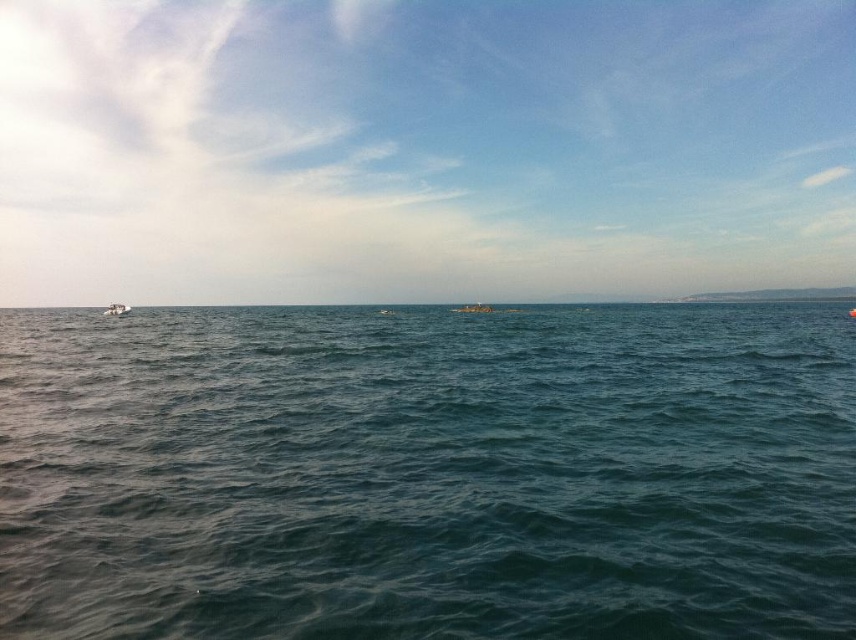
Who is positioned more to the right, blue water at center or metallic silver boat at center?

metallic silver boat at center

Is blue water at center shorter than metallic silver boat at center?

No.

Which is in front, point (409, 17) or point (468, 305)?

Point (468, 305) is more forward.

At what (x,y) coordinates should I click in order to perform the action: click on blue water at center. Please return your answer as a coordinate pair (x, y). Image resolution: width=856 pixels, height=640 pixels. Looking at the image, I should click on (421, 147).

Find the location of a particular element. blue water at center is located at coordinates (421, 147).

Is blue water at center above white plastic boat at left?

Correct, blue water at center is located above white plastic boat at left.

This screenshot has width=856, height=640. I want to click on blue water at center, so click(421, 147).

Is greenish-blue water at center below metallic silver boat at center?

Yes.

Does point (830, 620) come in front of point (467, 310)?

That is True.

What are the coordinates of `greenish-blue water at center` in the screenshot? It's located at (428, 474).